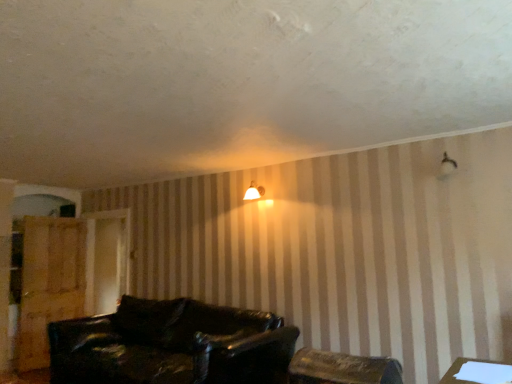
Describe the element at coordinates (477, 372) in the screenshot. I see `white paper at lower right` at that location.

In order to face leather couch at lower center, should I rotate leftwards or rightwards?

To face it directly, rotate left by 12.171 degrees.

Describe the element at coordinates (254, 192) in the screenshot. Image resolution: width=512 pixels, height=384 pixels. I see `matte white lampshade at upper center` at that location.

Where is `matte white lampshade at upper center`? matte white lampshade at upper center is located at coordinates (254, 192).

At what (x,y) coordinates should I click in order to perform the action: click on white paper at lower right. Please return your answer as a coordinate pair (x, y). The image size is (512, 384). Looking at the image, I should click on (477, 372).

Does point (40, 269) lie in front of point (85, 372)?

No, it is not.

Considering the relative positions of wooden dresser at left and leather couch at lower center in the image provided, is wooden dresser at left to the right of leather couch at lower center from the viewer's perspective?

No, wooden dresser at left is not to the right of leather couch at lower center.

The height and width of the screenshot is (384, 512). In order to click on dresser lying above the leather couch at lower center (from the image's perspective) in this screenshot , I will do `click(49, 284)`.

Is wooden dresser at left next to leather couch at lower center?

wooden dresser at left and leather couch at lower center are not in contact.

Is white paper at lower right far from wooden chair at lower center?

They are positioned close to each other.

Is white paper at lower right oriented away from wooden chair at lower center?

white paper at lower right does not have its back to wooden chair at lower center.

This screenshot has width=512, height=384. Find the location of `chair that is under the white paper at lower right (from a real-world perspective)`. chair that is under the white paper at lower right (from a real-world perspective) is located at coordinates (342, 368).

Is wooden chair at lower center positioned behind wooden dresser at left?

Answer: That is False.

Does wooden chair at lower center appear on the right side of wooden dresser at left?

Yes, wooden chair at lower center is to the right of wooden dresser at left.

Is wooden chair at lower center turned away from wooden dresser at left?

wooden chair at lower center is not turned away from wooden dresser at left.

This screenshot has width=512, height=384. What are the coordinates of `chair below the wooden dresser at left (from the image's perspective)` in the screenshot? It's located at (342, 368).

Which of these two, wooden chair at lower center or leather couch at lower center, stands shorter?

wooden chair at lower center.

Can you confirm if wooden chair at lower center is wider than leather couch at lower center?

No, wooden chair at lower center is not wider than leather couch at lower center.

From a real-world perspective, who is located higher, wooden chair at lower center or leather couch at lower center?

leather couch at lower center.

Which is in front, wooden chair at lower center or leather couch at lower center?

wooden chair at lower center.

How different are the orientations of matte white lampshade at upper center and white paper at lower right in degrees?

The angle between the facing direction of matte white lampshade at upper center and the facing direction of white paper at lower right is 91 degrees.

Between matte white lampshade at upper center and white paper at lower right, which one has larger width?

With larger width is matte white lampshade at upper center.

Between matte white lampshade at upper center and white paper at lower right, which one has smaller size?

white paper at lower right.

From the image's perspective, is matte white lampshade at upper center below white paper at lower right?

Incorrect, from the image's perspective, matte white lampshade at upper center is higher than white paper at lower right.

The width and height of the screenshot is (512, 384). Identify the location of chair on the right of matte white lampshade at upper center. (342, 368).

Which is more to the right, wooden chair at lower center or matte white lampshade at upper center?

Positioned to the right is wooden chair at lower center.

How far apart are wooden chair at lower center and matte white lampshade at upper center?

They are 1.81 meters apart.

Would you say wooden chair at lower center is outside matte white lampshade at upper center?

That's correct, wooden chair at lower center is outside of matte white lampshade at upper center.

Which is closer, [51,270] or [468,374]?

Point [51,270] is positioned farther from the camera compared to point [468,374].

Identify the location of table beneath the wooden dresser at left (from a real-world perspective). Image resolution: width=512 pixels, height=384 pixels. click(477, 372).

Which is behind, wooden dresser at left or white paper at lower right?

wooden dresser at left is behind.

Based on their sizes in the image, would you say wooden dresser at left is bigger or smaller than white paper at lower right?

Considering their sizes, wooden dresser at left takes up more space than white paper at lower right.

The width and height of the screenshot is (512, 384). I want to click on dresser behind the leather couch at lower center, so click(x=49, y=284).

Identify the location of table that appears above the wooden chair at lower center (from a real-world perspective). (477, 372).

Looking at this image, based on their spatial positions, is white paper at lower right or wooden dresser at left closer to matte white lampshade at upper center?

Based on the image, white paper at lower right appears to be nearer to matte white lampshade at upper center.

Estimate the real-world distances between objects in this image. Which object is closer to white paper at lower right, matte white lampshade at upper center or wooden chair at lower center?

The object closer to white paper at lower right is wooden chair at lower center.

Estimate the real-world distances between objects in this image. Which object is closer to leather couch at lower center, matte white lampshade at upper center or wooden dresser at left?

Among the two, wooden dresser at left is located nearer to leather couch at lower center.

When comparing their distances from wooden dresser at left, does leather couch at lower center or matte white lampshade at upper center seem further?

matte white lampshade at upper center is positioned further to the anchor wooden dresser at left.

From the image, which object appears to be farther from matte white lampshade at upper center, leather couch at lower center or white paper at lower right?

The object further to matte white lampshade at upper center is white paper at lower right.

Which object lies further to the anchor point wooden dresser at left, matte white lampshade at upper center or leather couch at lower center?

The object further to wooden dresser at left is matte white lampshade at upper center.

Estimate the real-world distances between objects in this image. Which object is closer to wooden dresser at left, wooden chair at lower center or white paper at lower right?

wooden chair at lower center is closer to wooden dresser at left.

Estimate the real-world distances between objects in this image. Which object is closer to white paper at lower right, leather couch at lower center or wooden chair at lower center?

Among the two, wooden chair at lower center is located nearer to white paper at lower right.

You are a GUI agent. You are given a task and a screenshot of the screen. Output one action in this format:
    pyautogui.click(x=<x>, y=<y>)
    Task: Click on the chair located between wooden dresser at left and white paper at lower right in the left-right direction
    The width and height of the screenshot is (512, 384).
    Given the screenshot: What is the action you would take?
    pyautogui.click(x=342, y=368)

Find the location of a particular element. This screenshot has width=512, height=384. studio couch between wooden dresser at left and wooden chair at lower center in the horizontal direction is located at coordinates (170, 345).

Find the location of `lamp located between wooden dresser at left and white paper at lower right in the left-right direction`. lamp located between wooden dresser at left and white paper at lower right in the left-right direction is located at coordinates tap(254, 192).

Locate an element on the screen. Image resolution: width=512 pixels, height=384 pixels. lamp located between wooden dresser at left and wooden chair at lower center in the left-right direction is located at coordinates (254, 192).